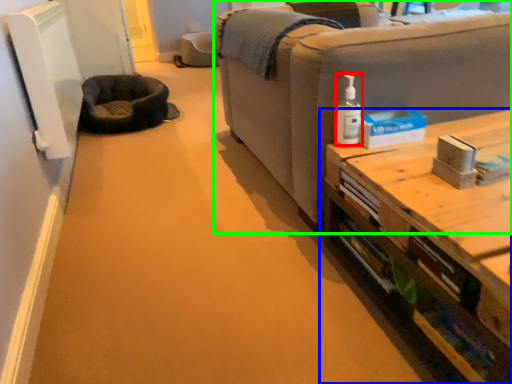
Question: Considering the real-world distances, which object is farthest from toiletry (highlighted by a red box)? table (highlighted by a blue box) or studio couch (highlighted by a green box)?

Choices:
 (A) table
 (B) studio couch

Answer: (A)